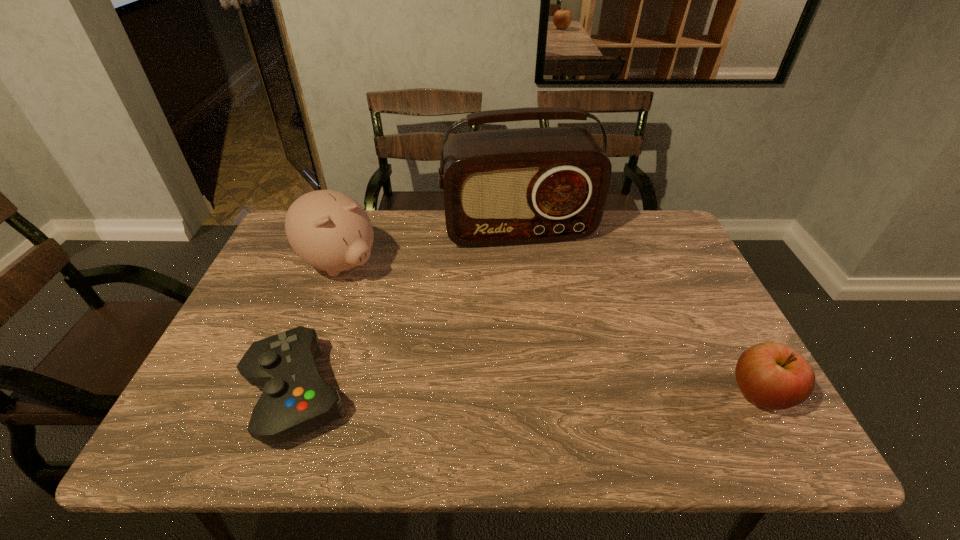
This screenshot has width=960, height=540. Identify the location of free space between the third tallest object and the control. (528, 393).

At what (x,y) coordinates should I click in order to perform the action: click on the second closest object to the shortest object. Please return your answer as a coordinate pair (x, y). The width and height of the screenshot is (960, 540). Looking at the image, I should click on [501, 187].

Select which object is the closest to the rightmost object. Please provide its 2D coordinates. Your answer should be formatted as a tuple, i.e. [(x, y)], where the tuple contains the x and y coordinates of a point satisfying the conditions above.

[(501, 187)]

This screenshot has height=540, width=960. Identify the location of free space in the image that satisfies the following two spatial constraints: 1. on the back side of the radio receiver; 2. on the right side of the shortest object. (354, 231).